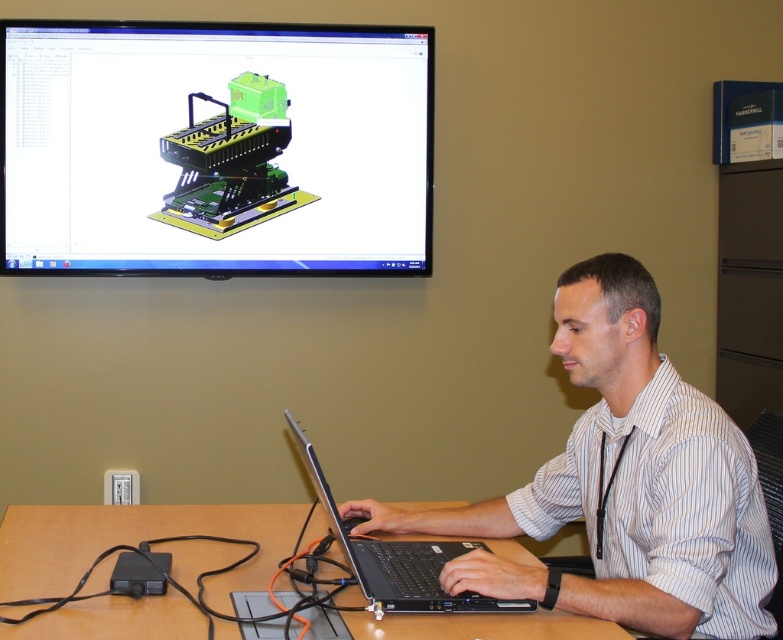
Is brown wooden table at center thinner than black matte laptop at center?

Incorrect, brown wooden table at center's width is not less than black matte laptop at center's.

Between brown wooden table at center and black matte laptop at center, which one has more height?

black matte laptop at center

Find the location of `brown wooden table at center`. brown wooden table at center is located at coordinates (135, 541).

Does white striped shirt at center appear under brown wooden table at center?

No.

Is point (502, 582) farther from camera compared to point (269, 561)?

No, it is not.

This screenshot has height=640, width=783. What are the coordinates of `white striped shirt at center` in the screenshot? It's located at (623, 484).

Is point (343, 106) farther from viewer compared to point (412, 544)?

Yes, point (343, 106) is farther from viewer.

Is point (45, 179) positioned before point (462, 596)?

No, (45, 179) is further to viewer.

At what (x,y) coordinates should I click in order to perform the action: click on matte black monitor at upper center. Please return your answer as a coordinate pair (x, y). Looking at the image, I should click on (215, 148).